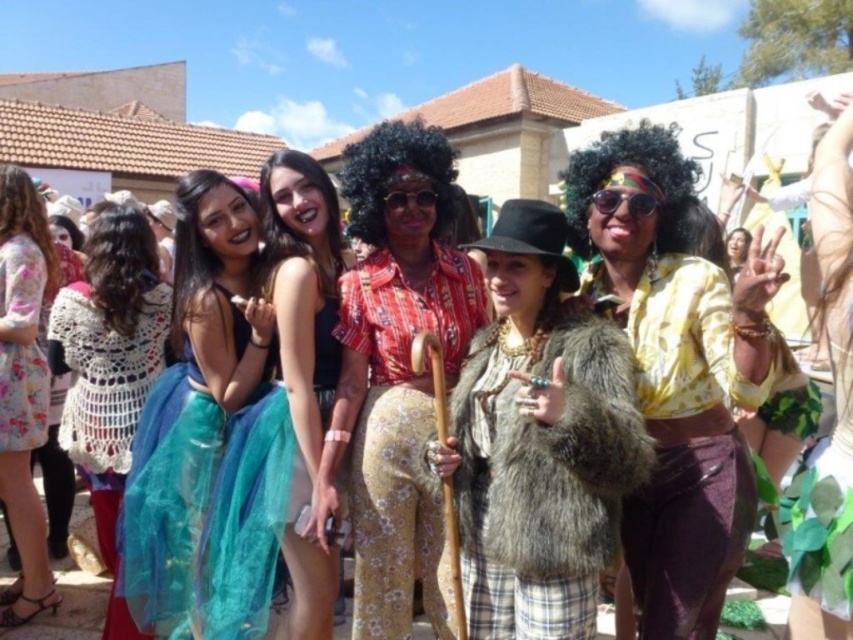
You are organizing a photo shoot and need to arrange the models in order from smallest to largest based on their dresses. Given the shiny black dress at center and the floral dress at left, which dress should be placed first?

The floral dress at left should be placed first since it is smaller than the shiny black dress at center.

You are organizing a clothing donation drive and need to determine which of the two items, the fur coat at center or the crochet sweater at left, can fit into a standard donation bin that is 3 feet wide. Based on their widths, which item is more likely to fit?

The crochet sweater at left is narrower than the fur coat at center. Since the donation bin is 3 feet wide, the crochet sweater at left is more likely to fit as it has a smaller width compared to the fur coat at center.